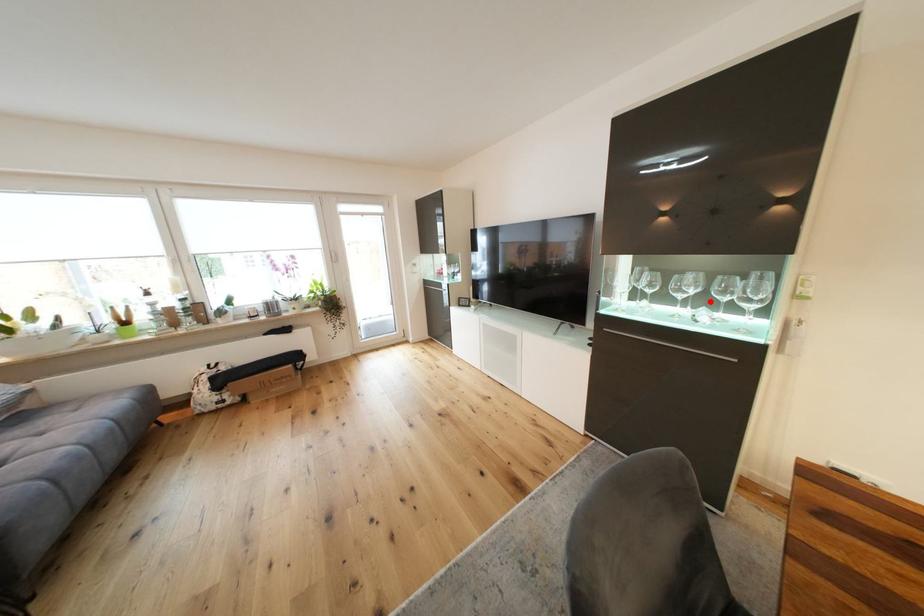
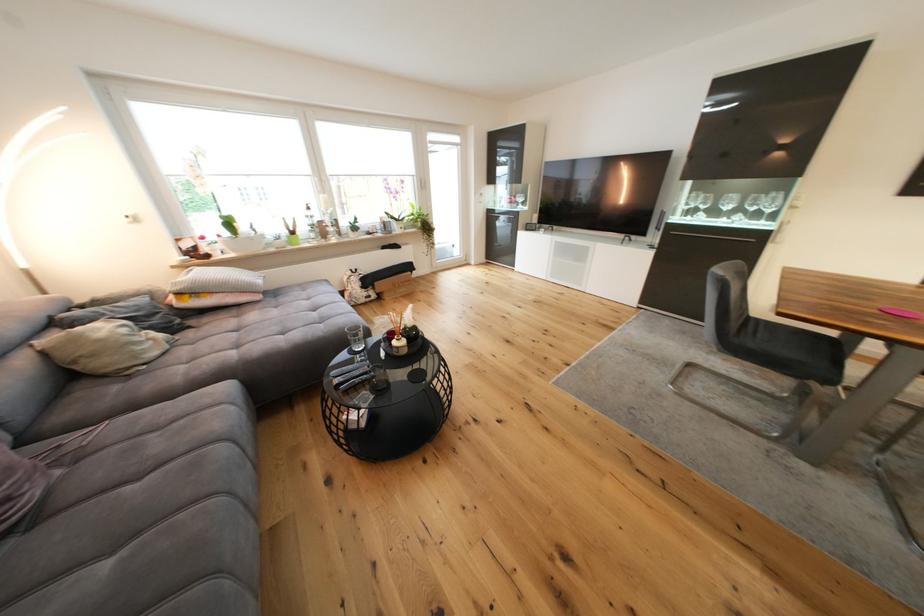
Where in the second image is the point corresponding to the highlighted location from the first image?

(746, 212)